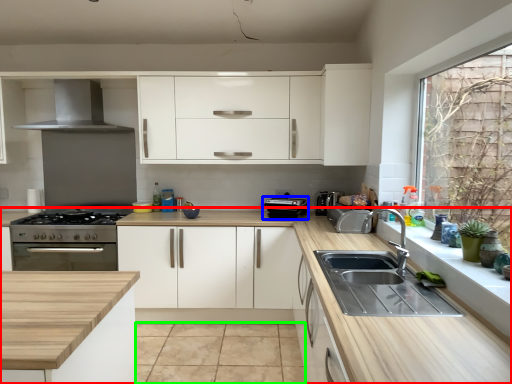
Question: Which is nearer to the countertop (highlighted by a red box)? appliance (highlighted by a blue box) or tile (highlighted by a green box).

Choices:
 (A) appliance
 (B) tile

Answer: (A)